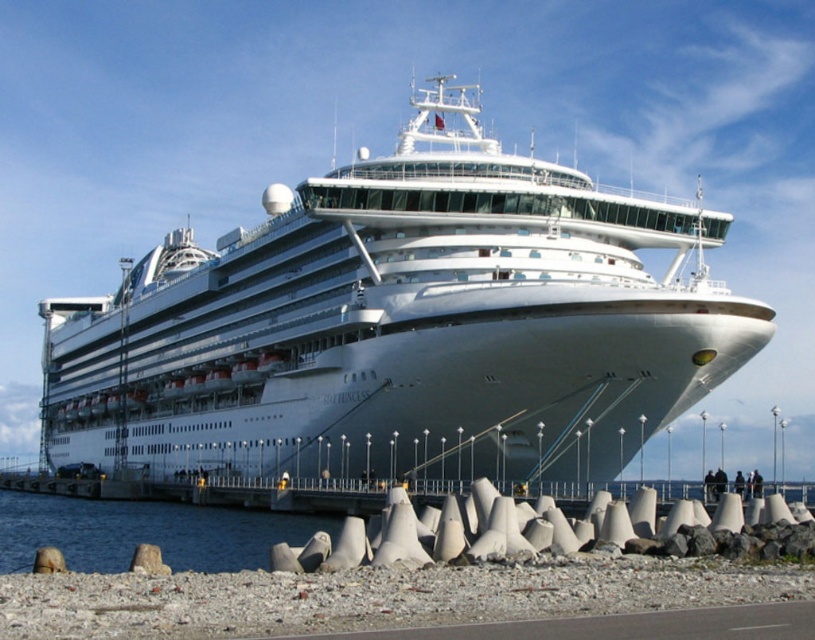
You are standing on the pier and see the white glossy cruise ship at center and the clear water at lower left. Which object is positioned to the right of the other?

The white glossy cruise ship at center is to the right of clear water at lower left.

You are standing on the pier and looking towards the white glossy cruise ship at center. Which direction should you walk to get closer to the clear water at lower left?

To get closer to the clear water at lower left, you should walk towards the lower left direction, as the white glossy cruise ship at center is located above it, meaning the water is positioned below and to the left of the ship.

You are standing on the pier and see the point marked at coordinates (402, 324). What does this point indicate?

The point at coordinates (402, 324) indicates the white glossy cruise ship at center.